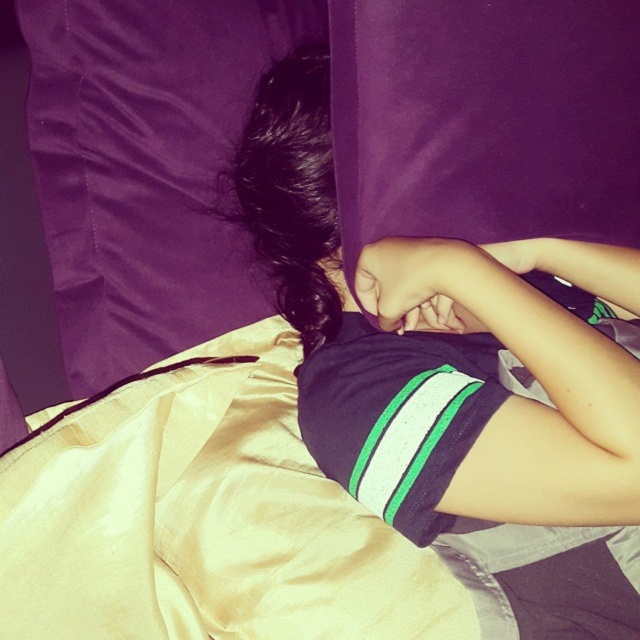
Find the location of a particular element. beige satin blanket at center is located at coordinates (204, 516).

Does beige satin blanket at center appear under purple satin pillow at upper left?

Indeed, beige satin blanket at center is positioned under purple satin pillow at upper left.

Based on the photo, measure the distance between point (253,584) and camera.

Point (253,584) is 26.92 inches from camera.

Locate an element on the screen. The height and width of the screenshot is (640, 640). beige satin blanket at center is located at coordinates (204, 516).

Is black jersey at center positioned in front of purple satin pillow at upper left?

Yes, it is.

Which of these two, black jersey at center or purple satin pillow at upper left, stands taller?

black jersey at center is taller.

What are the coordinates of `black jersey at center` in the screenshot? It's located at (458, 381).

This screenshot has height=640, width=640. In order to click on black jersey at center in this screenshot , I will do `click(458, 381)`.

Does purple satin pillow at upper left come behind purple satin pillow at upper center?

That is True.

Locate an element on the screen. purple satin pillow at upper left is located at coordinates (147, 168).